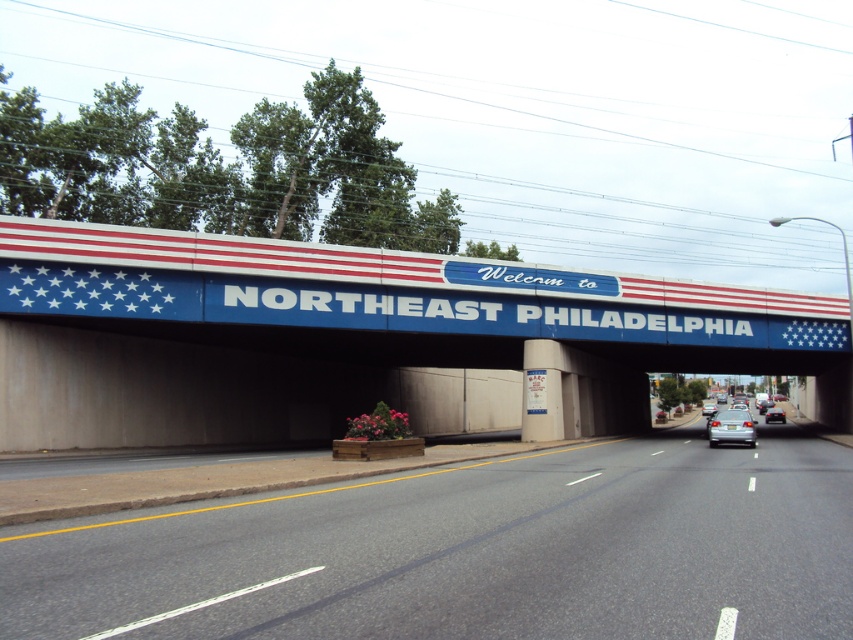
This screenshot has height=640, width=853. Find the location of `asphalt road at center`. asphalt road at center is located at coordinates (473, 552).

Between point (345, 524) and point (709, 436), which one is positioned in front?

Point (345, 524)

The image size is (853, 640). In order to click on asphalt road at center in this screenshot , I will do `click(473, 552)`.

Can you confirm if asphalt road at center is bigger than silver metallic sedan at center?

Yes.

Describe the element at coordinates (473, 552) in the screenshot. I see `asphalt road at center` at that location.

You are a GUI agent. You are given a task and a screenshot of the screen. Output one action in this format:
    pyautogui.click(x=<x>, y=<y>)
    Task: Click on the asphalt road at center
    This screenshot has width=853, height=640.
    Given the screenshot: What is the action you would take?
    pyautogui.click(x=473, y=552)

Is asphalt road at center smaller than blue painted concrete bridge at upper center?

Yes.

Locate an element on the screen. asphalt road at center is located at coordinates (473, 552).